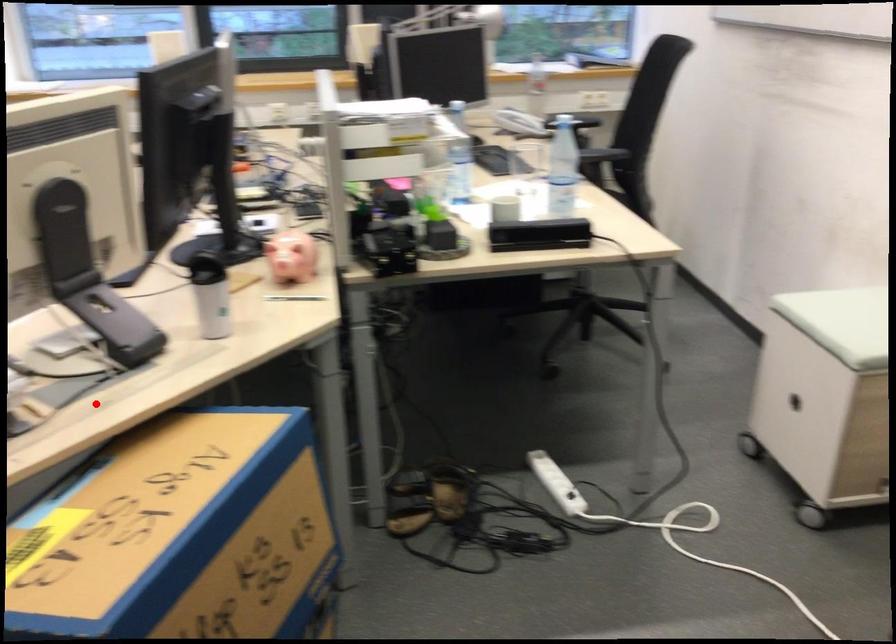
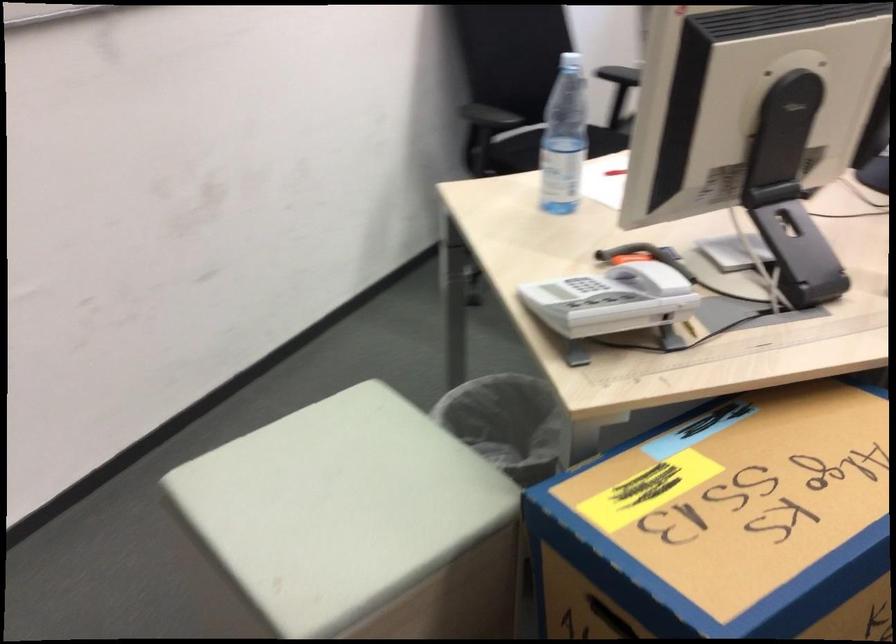
Question: A red point is marked in image1. In image2, is the corresponding 3D point closer to the camera or farther? Reply with the corresponding letter.

Choices:
 (A) The corresponding 3D point is closer.
 (B) The corresponding 3D point is farther.

Answer: (A)